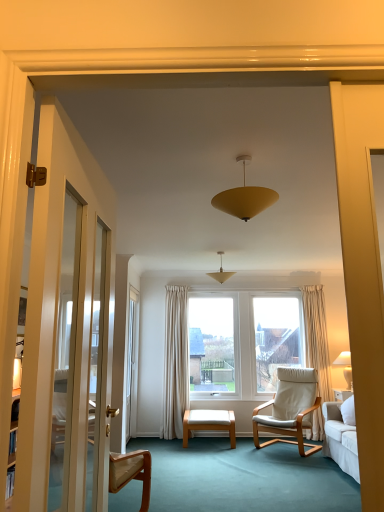
Question: Is white wood stool at center thinner than white glossy screen door at left?

Choices:
 (A) yes
 (B) no

Answer: (B)

Question: Is white wood stool at center placed right next to white glossy screen door at left?

Choices:
 (A) yes
 (B) no

Answer: (B)

Question: Considering the relative sizes of white wood stool at center and white glossy screen door at left in the image provided, is white wood stool at center taller than white glossy screen door at left?

Choices:
 (A) no
 (B) yes

Answer: (A)

Question: Is white wood stool at center at the right side of white glossy screen door at left?

Choices:
 (A) yes
 (B) no

Answer: (A)

Question: From the image's perspective, would you say white wood stool at center is positioned over white glossy screen door at left?

Choices:
 (A) yes
 (B) no

Answer: (B)

Question: Could you tell me if white wood stool at center is turned towards white glossy screen door at left?

Choices:
 (A) no
 (B) yes

Answer: (A)

Question: From a real-world perspective, is matte yellow cone at center below white glossy screen door at left?

Choices:
 (A) no
 (B) yes

Answer: (A)

Question: Considering the relative sizes of matte yellow cone at center and white glossy screen door at left in the image provided, is matte yellow cone at center bigger than white glossy screen door at left?

Choices:
 (A) no
 (B) yes

Answer: (A)

Question: Considering the relative sizes of matte yellow cone at center and white glossy screen door at left in the image provided, is matte yellow cone at center shorter than white glossy screen door at left?

Choices:
 (A) yes
 (B) no

Answer: (A)

Question: Is matte yellow cone at center to the left of white glossy screen door at left from the viewer's perspective?

Choices:
 (A) yes
 (B) no

Answer: (B)

Question: Considering the relative sizes of matte yellow cone at center and white glossy screen door at left in the image provided, is matte yellow cone at center thinner than white glossy screen door at left?

Choices:
 (A) yes
 (B) no

Answer: (B)

Question: Could white glossy screen door at left be considered to be inside matte yellow cone at center?

Choices:
 (A) yes
 (B) no

Answer: (B)

Question: Does white glossy screen door at left come in front of matte yellow cone at center?

Choices:
 (A) no
 (B) yes

Answer: (A)